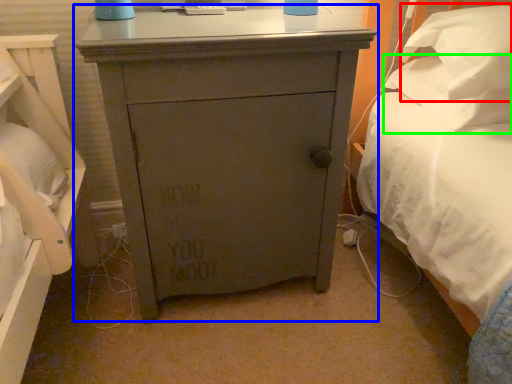
Question: Which object is the farthest from pillow (highlighted by a red box)? Choose among these: chest of drawers (highlighted by a blue box) or pillow (highlighted by a green box).

Choices:
 (A) chest of drawers
 (B) pillow

Answer: (A)